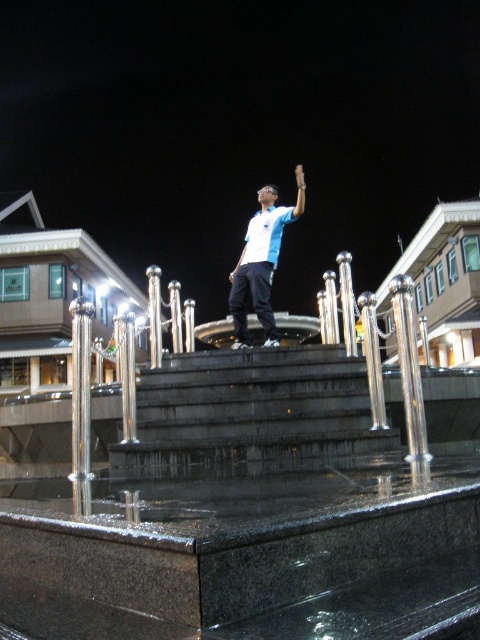
Between point (216, 474) and point (272, 332), which one is positioned behind?

Point (272, 332)

You are a GUI agent. You are given a task and a screenshot of the screen. Output one action in this format:
    pyautogui.click(x=<x>, y=<y>)
    Task: Click on the black granite stairs at center
    The image size is (480, 640).
    Given the screenshot: What is the action you would take?
    pyautogui.click(x=252, y=417)